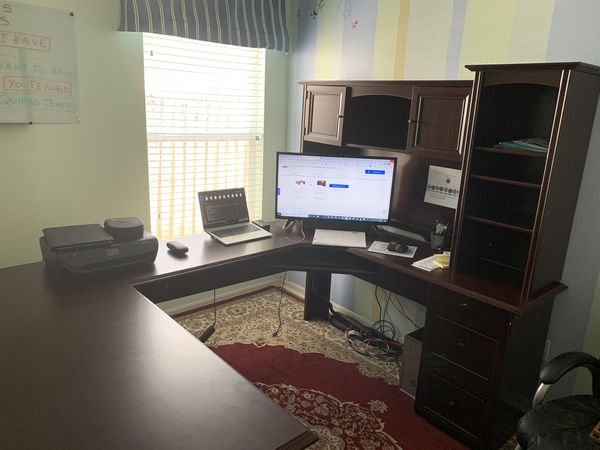
Where is `empty desk space`? empty desk space is located at coordinates (100, 367).